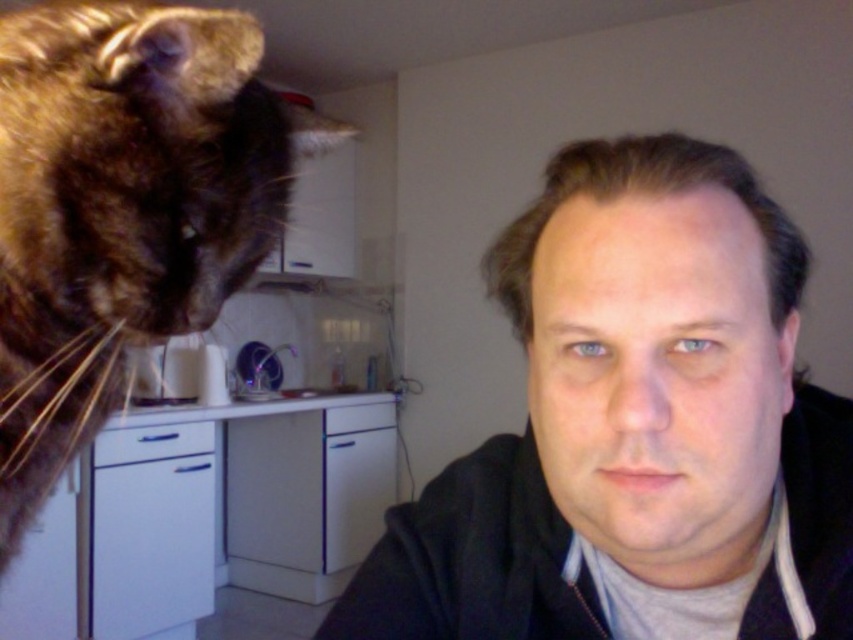
Question: Which point appears closest to the camera in this image?

Choices:
 (A) (354, 630)
 (B) (241, 90)

Answer: (A)

Question: Is matte black jacket at center thinner than brown fur cat at upper left?

Choices:
 (A) no
 (B) yes

Answer: (B)

Question: Does matte black jacket at center have a larger size compared to brown fur cat at upper left?

Choices:
 (A) yes
 (B) no

Answer: (B)

Question: Among these objects, which one is nearest to the camera?

Choices:
 (A) brown fur cat at upper left
 (B) matte black jacket at center

Answer: (B)

Question: Is matte black jacket at center further to the viewer compared to brown fur cat at upper left?

Choices:
 (A) yes
 (B) no

Answer: (B)